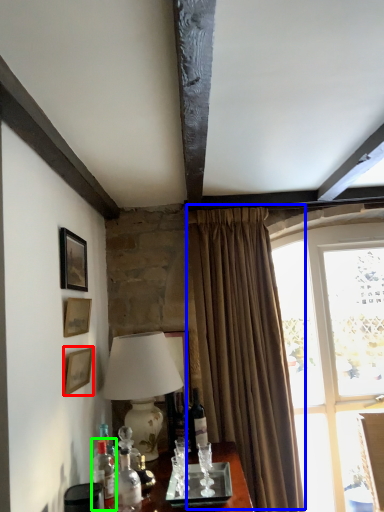
Question: Estimate the real-world distances between objects in this image. Which object is farther from picture frame (highlighted by a red box), curtain (highlighted by a blue box) or bottle (highlighted by a green box)?

Choices:
 (A) curtain
 (B) bottle

Answer: (A)